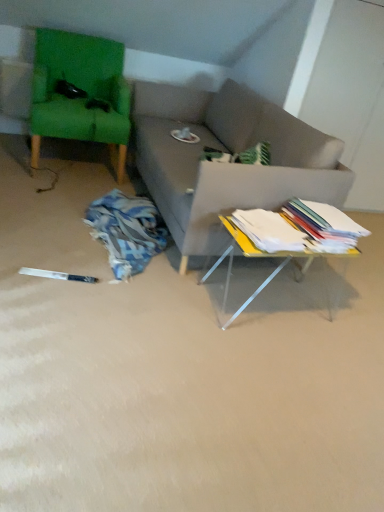
Image resolution: width=384 pixels, height=512 pixels. Find the location of `free space in front of yellow acrylic table at lower right`. free space in front of yellow acrylic table at lower right is located at coordinates (279, 367).